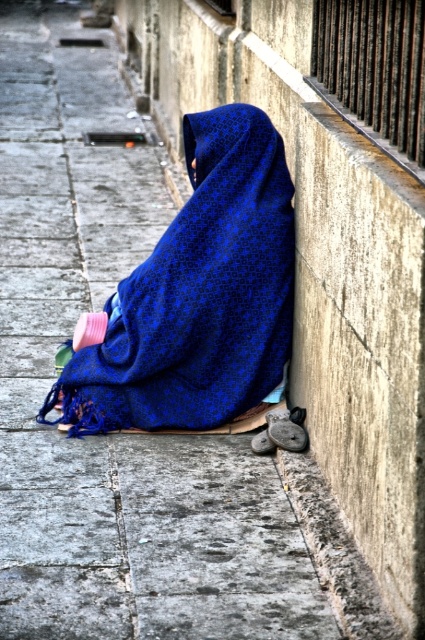
You are a delivery person trying to place a small package on the ground near the gray concrete curb at lower right. Will the blue woven blanket at lower center interfere with placing the package there?

The blue woven blanket at lower center is bigger than the gray concrete curb at lower right, so it might extend over the area near the curb, potentially making it harder to place the package there without moving the blanket.

You are a delivery person who needs to place a small package on the ground near the blue woven blanket at lower center and the gray concrete curb at lower right. Which object should you place it closer to if you want the package to be as far as possible from the curb?

You should place the package closer to the blue woven blanket at lower center since it is to the left of the gray concrete curb at lower right, so positioning it near the blanket keeps it farther from the curb.